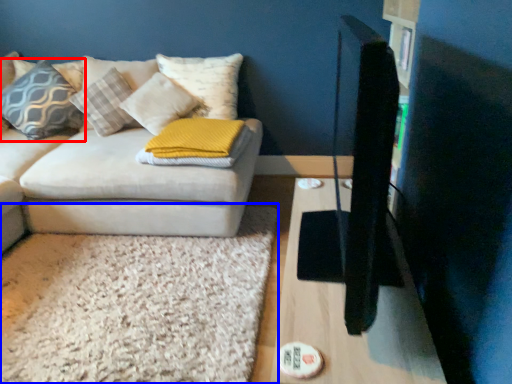
Question: Among these objects, which one is nearest to the camera, pillow (highlighted by a red box) or mat (highlighted by a blue box)?

Choices:
 (A) pillow
 (B) mat

Answer: (B)